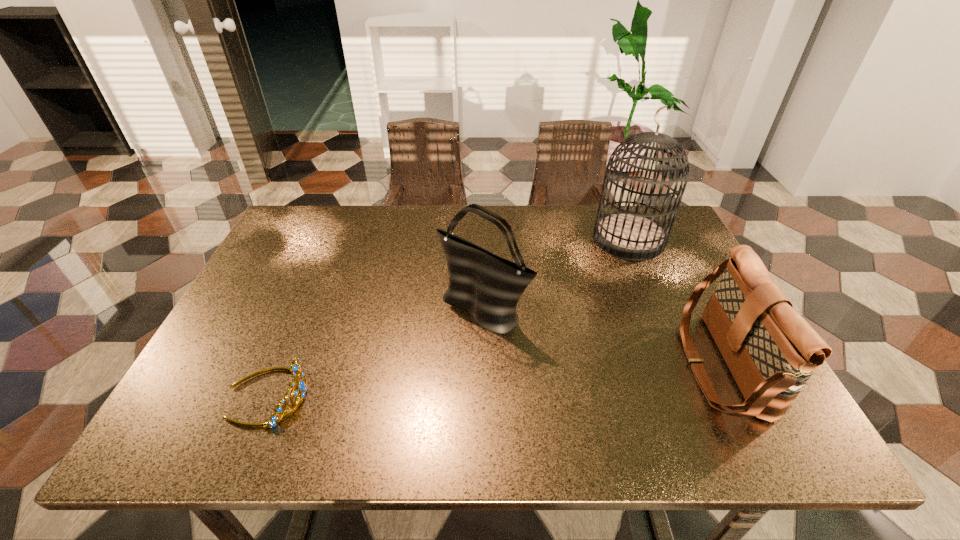
At what (x,y) coordinates should I click in order to perform the action: click on free location that satisfies the following two spatial constraints: 1. on the back side of the second tallest object; 2. on the right side of the birdcage. Please return your answer as a coordinate pair (x, y). Looking at the image, I should click on (483, 239).

The image size is (960, 540). I want to click on vacant space that satisfies the following two spatial constraints: 1. on the front side of the farthest object; 2. on the front-facing side of the leftmost object, so click(696, 395).